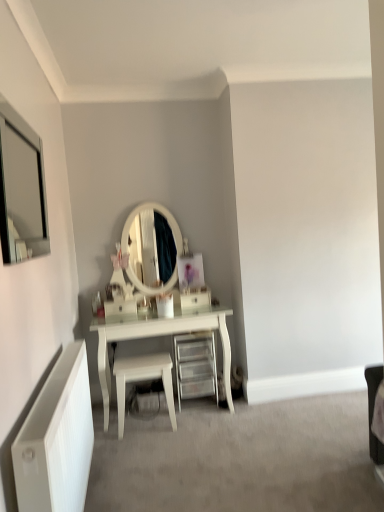
Question: Is point (140, 373) positioned closer to the camera than point (183, 369)?

Choices:
 (A) closer
 (B) farther

Answer: (A)

Question: Considering the relative positions of white glossy stool at center and clear plastic drawer at center in the image provided, is white glossy stool at center to the left or to the right of clear plastic drawer at center?

Choices:
 (A) left
 (B) right

Answer: (A)

Question: Estimate the real-world distances between objects in this image. Which object is farther from the clear plastic drawer at center?

Choices:
 (A) white matte radiator at lower left
 (B) white glossy stool at center
 (C) matte silver mirror at upper left
 (D) white glossy drawer at center

Answer: (C)

Question: Considering the real-world distances, which object is farthest from the clear plastic drawer at center?

Choices:
 (A) white glossy stool at center
 (B) white matte radiator at lower left
 (C) white glossy drawer at center
 (D) matte silver mirror at upper left

Answer: (D)